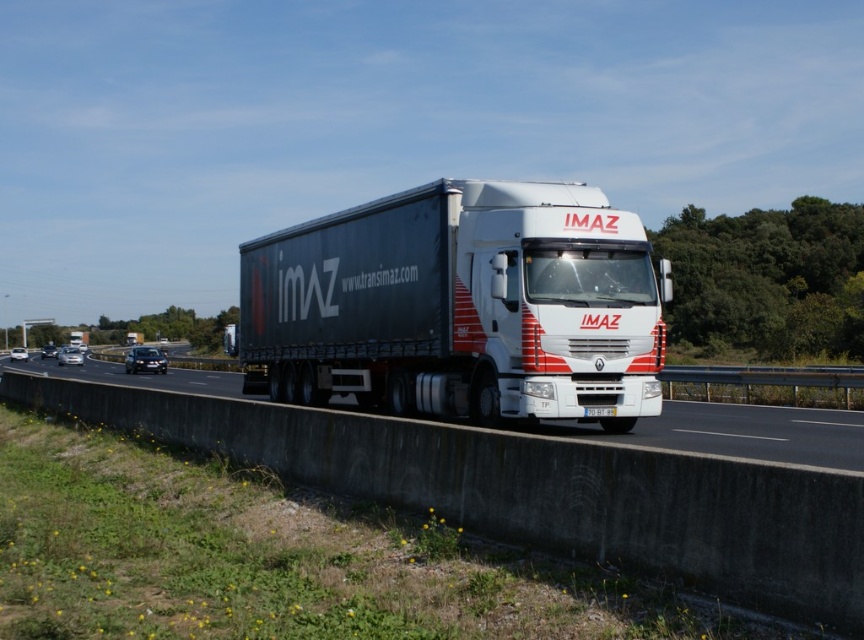
Between point (334, 220) and point (216, 390), which one is positioned behind?

The point (216, 390) is behind.

Is matte black trailer truck at center positioned before white glossy truck at center?

No, it is behind white glossy truck at center.

In order to click on matte black trailer truck at center in this screenshot , I will do `click(459, 307)`.